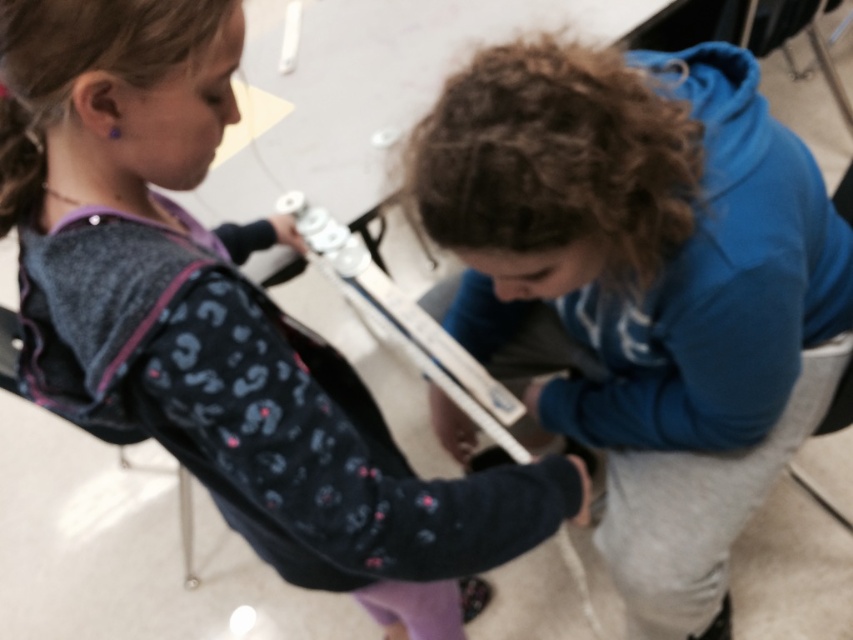
Is blue fleece hoodie at center smaller than matte black hoodie at center?

Indeed, blue fleece hoodie at center has a smaller size compared to matte black hoodie at center.

Does point (759, 458) lie behind point (233, 301)?

Yes, it is.

You are a GUI agent. You are given a task and a screenshot of the screen. Output one action in this format:
    pyautogui.click(x=<x>, y=<y>)
    Task: Click on the blue fleece hoodie at center
    Image resolution: width=853 pixels, height=640 pixels.
    Given the screenshot: What is the action you would take?
    pyautogui.click(x=643, y=285)